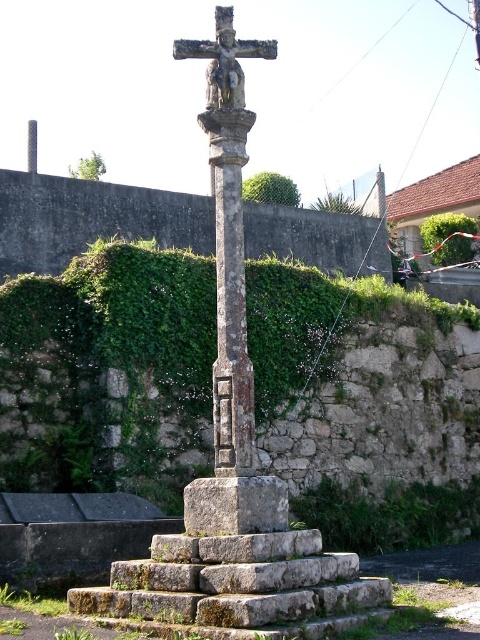
Question: Among these points, which one is nearest to the camera?

Choices:
 (A) (184, 490)
 (B) (247, 179)

Answer: (A)

Question: Observing the image, what is the correct spatial positioning of rusty stone cross at center in reference to rusty stone column at center?

Choices:
 (A) above
 (B) below

Answer: (A)

Question: Is rusty stone cross at center wider than rusty stone column at center?

Choices:
 (A) no
 (B) yes

Answer: (B)

Question: Which object is farther from the camera taking this photo?

Choices:
 (A) rusty stone column at center
 (B) green leafy hedge at upper center
 (C) stone statue at center
 (D) green leafy hedge at upper right

Answer: (D)

Question: Among these points, which one is nearest to the camera?

Choices:
 (A) 238,67
 (B) 275,196

Answer: (A)

Question: Can you confirm if stone statue at center is thinner than green leafy hedge at upper center?

Choices:
 (A) yes
 (B) no

Answer: (A)